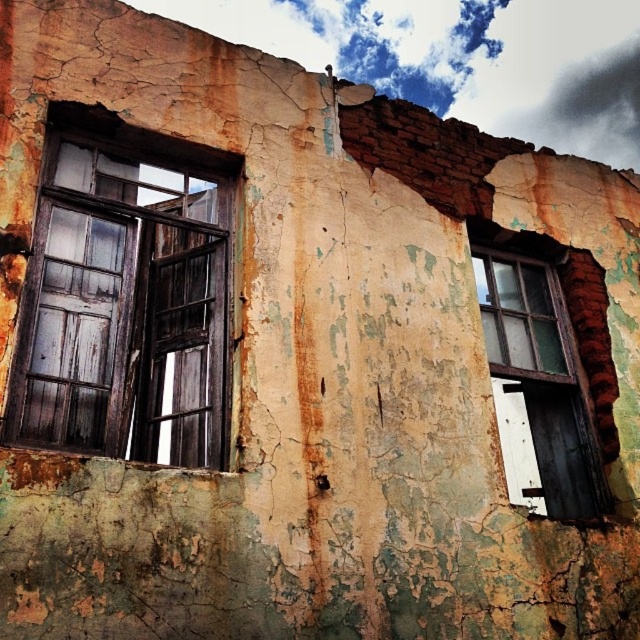
Question: Does wooden window at left appear under wooden window at right?

Choices:
 (A) no
 (B) yes

Answer: (A)

Question: Among these objects, which one is nearest to the camera?

Choices:
 (A) wooden window at right
 (B) wooden window at left

Answer: (B)

Question: Is wooden window at left wider than wooden window at right?

Choices:
 (A) yes
 (B) no

Answer: (B)

Question: Which of the following is the closest to the observer?

Choices:
 (A) (136, 266)
 (B) (497, 392)

Answer: (A)

Question: Is wooden window at left to the left of wooden window at right from the viewer's perspective?

Choices:
 (A) yes
 (B) no

Answer: (A)